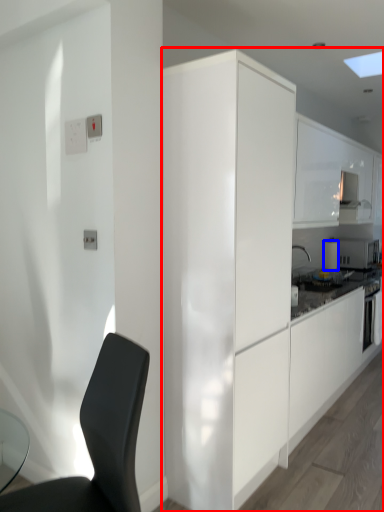
Question: Which object appears closest to the camera in this image, cabinetry (highlighted by a red box) or appliance (highlighted by a blue box)?

Choices:
 (A) cabinetry
 (B) appliance

Answer: (A)